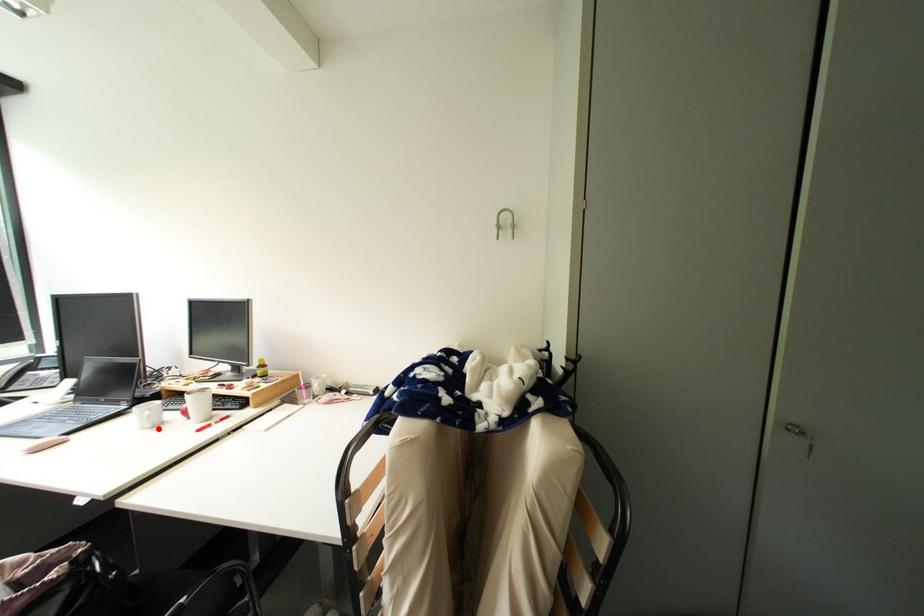
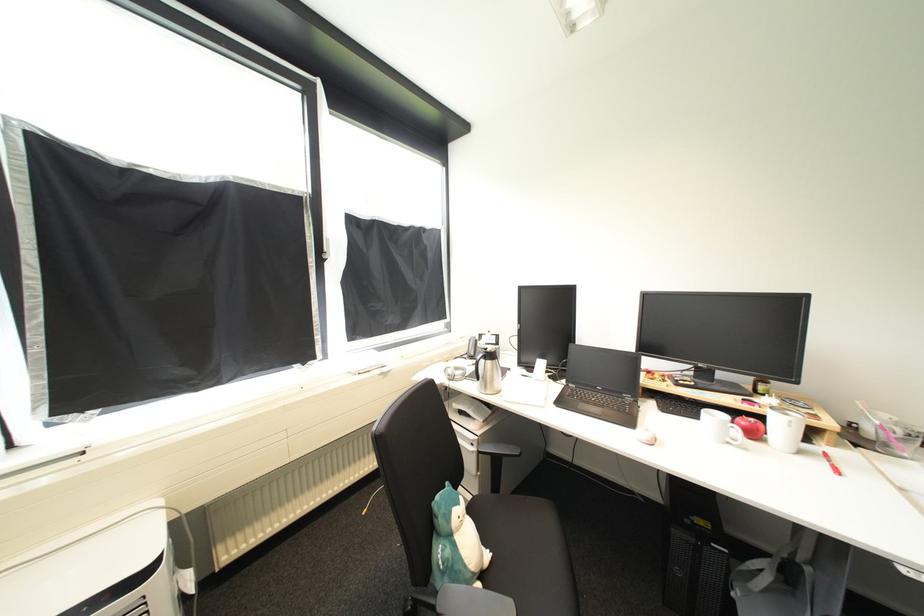
The point at the highlighted location is marked in the first image. Where is the corresponding point in the second image?

(736, 445)